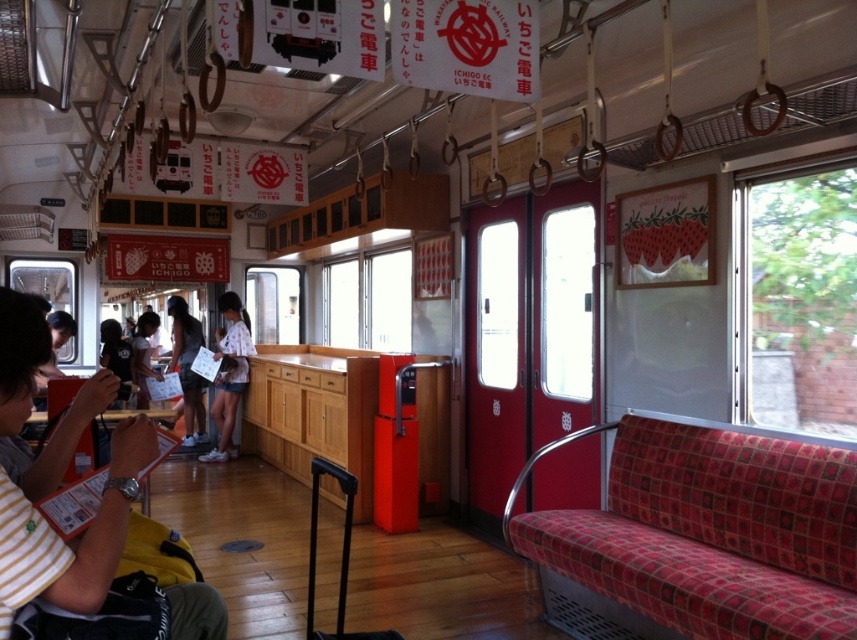
Question: Is yellow fabric bag at left to the left of dark gray fabric shirt at center from the viewer's perspective?

Choices:
 (A) yes
 (B) no

Answer: (B)

Question: Can you confirm if dark gray fabric shirt at center is thinner than light blue denim shorts at center?

Choices:
 (A) yes
 (B) no

Answer: (B)

Question: Does red patterned fabric seat at right have a lesser width compared to white cotton shirt at center?

Choices:
 (A) no
 (B) yes

Answer: (A)

Question: Considering the real-world distances, which object is farthest from the light brown fabric shirt at center left?

Choices:
 (A) yellow fabric bag at left
 (B) white cotton shirt at center
 (C) light blue denim shorts at center
 (D) red patterned fabric seat at right

Answer: (A)

Question: Which point is closer to the camera?

Choices:
 (A) light brown fabric shirt at center left
 (B) dark gray fabric shirt at center
 (C) light blue denim shorts at center
 (D) red patterned fabric seat at right

Answer: (D)

Question: Which point is farther from the camera taking this photo?

Choices:
 (A) (171, 365)
 (B) (33, 534)
 (C) (226, 328)
 (D) (139, 396)

Answer: (A)